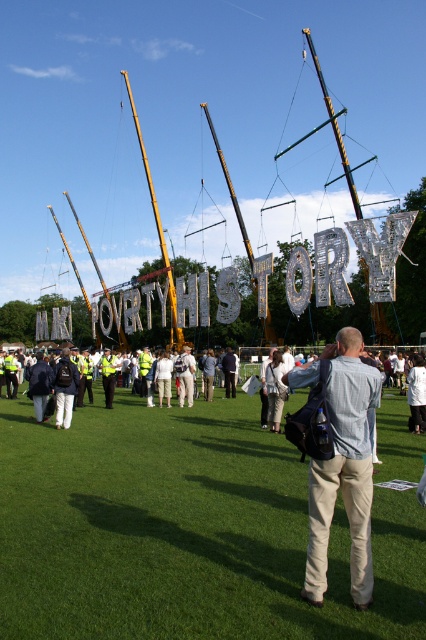
Based on the scene description, which object is larger between the yellow metallic mast at center and the black polished wood mast at center?

The yellow metallic mast at center is bigger than the black polished wood mast at center.

You are a photographer positioned at the edge of the field. You want to capture a photo that includes both the green grass at center and the light blue shirt at center. Given the distance between them, will you need to adjust your camera lens to a wider angle to ensure both are in frame?

The green grass at center and light blue shirt at center are 11.24 meters apart. To capture both in the same frame, you would need to use a wider angle lens to accommodate the distance between them.

You are a photographer at the event and want to capture both the green grass at center and the light blue shirt at center in the same frame. Which object should you focus on to ensure both are in the frame?

The green grass at center is larger in size than the light blue shirt at center, so focusing on the green grass at center will ensure both objects are included in the frame.